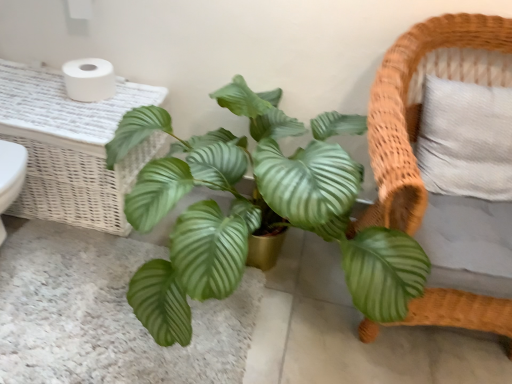
Find the location of a particular element. free space above green glossy leaf at center (from a real-world perspective) is located at coordinates (91, 302).